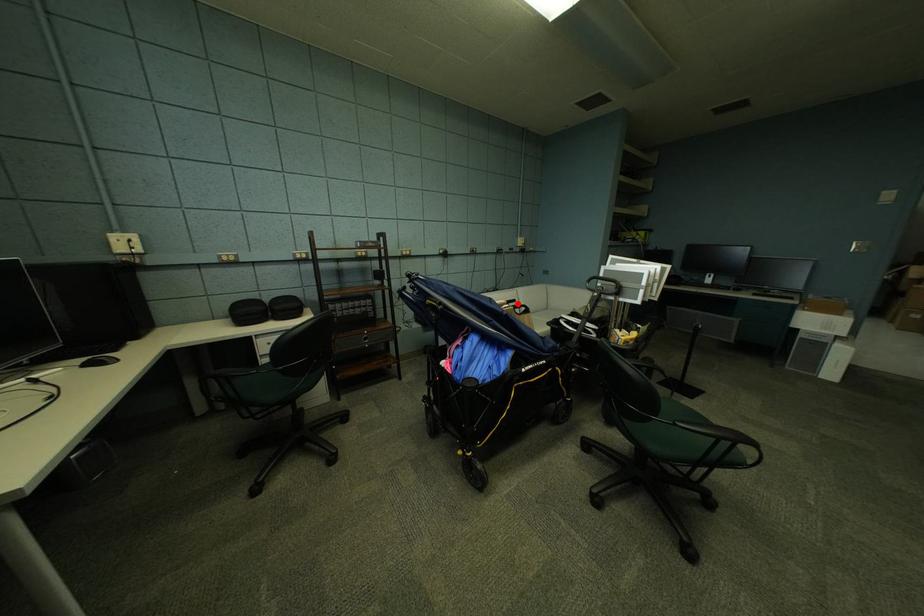
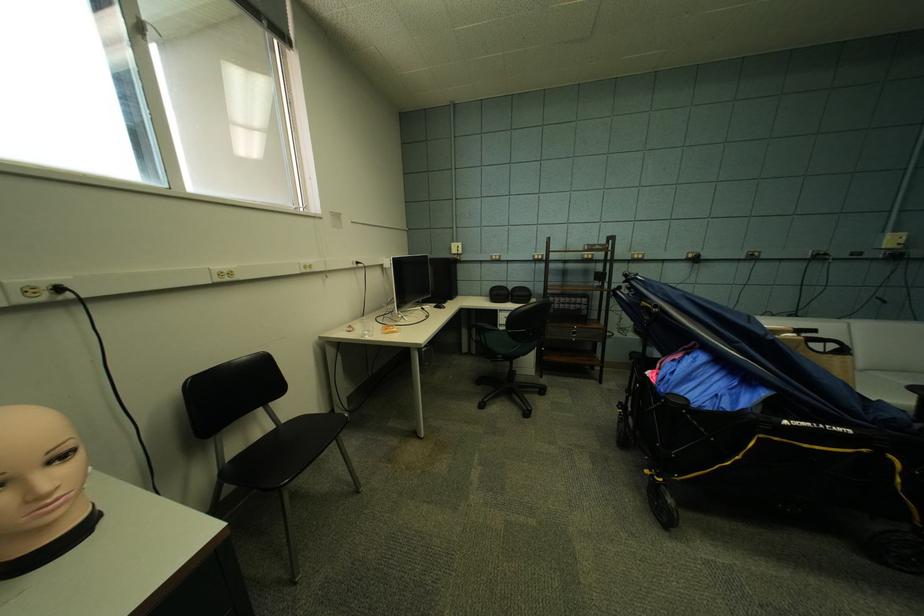
The point at the highlighted location is marked in the first image. Where is the corresponding point in the second image?

(808, 331)